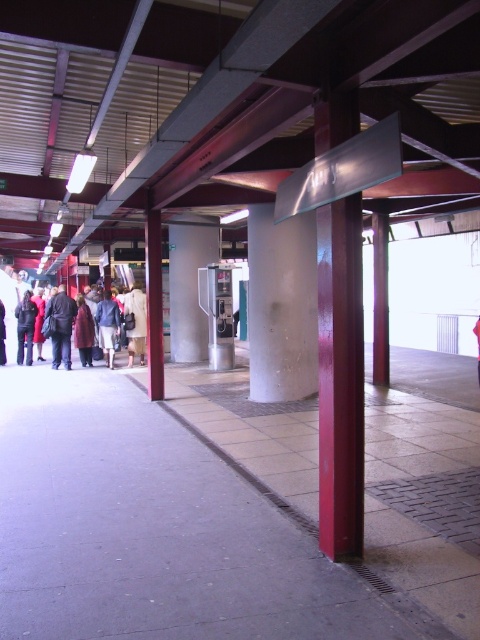
Does white concrete pillar at center have a greater height compared to dark brown leather jacket at left?

No.

Is white concrete pillar at center behind dark brown leather jacket at left?

No.

Who is more distant from viewer, (265,376) or (2,298)?

The point (2,298) is more distant.

Where is `white concrete pillar at center`? white concrete pillar at center is located at coordinates (282, 305).

Where is `glossy red pillar at center`? glossy red pillar at center is located at coordinates (340, 378).

Does glossy red pillar at center appear on the right side of light beige coat at center?

Correct, you'll find glossy red pillar at center to the right of light beige coat at center.

Does point (331, 532) lie in front of point (136, 300)?

Yes, point (331, 532) is closer to viewer.

Where is `glossy red pillar at center`? The image size is (480, 640). glossy red pillar at center is located at coordinates (340, 378).

Which is more to the right, gray concrete pavement at center or light beige coat at center?

gray concrete pavement at center is more to the right.

Does gray concrete pavement at center have a greater height compared to light beige coat at center?

No.

This screenshot has width=480, height=640. What do you see at coordinates (225, 513) in the screenshot? I see `gray concrete pavement at center` at bounding box center [225, 513].

The width and height of the screenshot is (480, 640). Find the location of `gray concrete pavement at center`. gray concrete pavement at center is located at coordinates (225, 513).